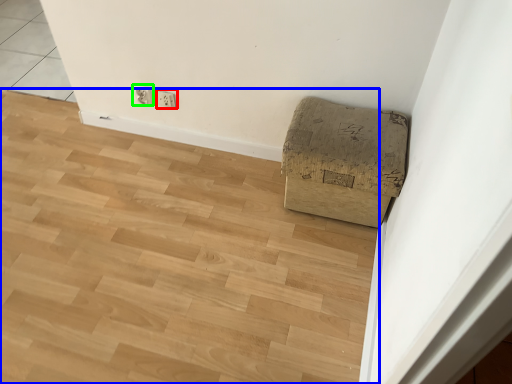
Question: Which object is the closest to the electric outlet (highlighted by a red box)? Choose among these: plywood (highlighted by a blue box) or electric outlet (highlighted by a green box).

Choices:
 (A) plywood
 (B) electric outlet

Answer: (B)